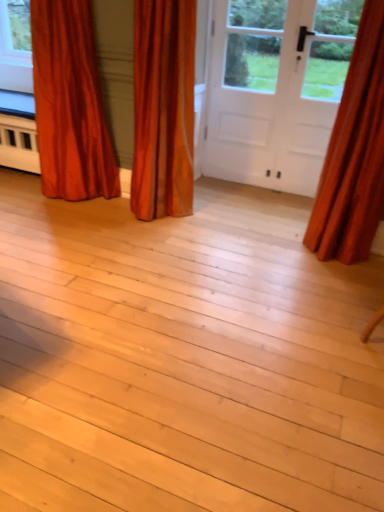
This screenshot has height=512, width=384. Identify the location of free spot below velvet orange curtain at left, which appears as the third curtain when viewed from the right (from a real-world perspective). (82, 203).